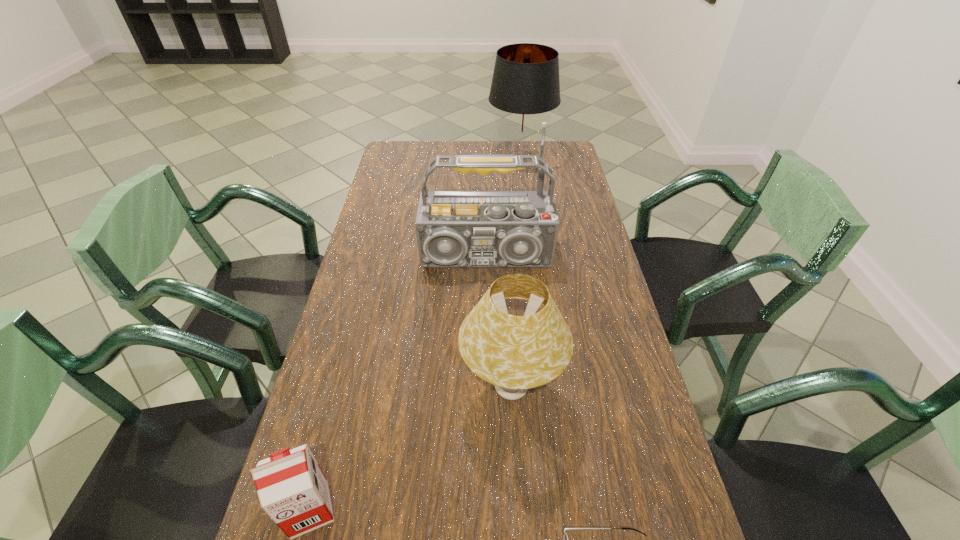
The image size is (960, 540). Identify the location of the farther lampshade. (525, 86).

The image size is (960, 540). In order to click on the farthest object in this screenshot , I will do `click(525, 86)`.

Where is `radio receiver`? radio receiver is located at coordinates (455, 229).

Where is `the third tallest object`? The width and height of the screenshot is (960, 540). the third tallest object is located at coordinates (514, 353).

The image size is (960, 540). I want to click on the shorter lampshade, so click(x=514, y=353).

Image resolution: width=960 pixels, height=540 pixels. Find the location of `the fourth tallest object`. the fourth tallest object is located at coordinates (292, 489).

Image resolution: width=960 pixels, height=540 pixels. I want to click on soya milk, so click(292, 489).

The image size is (960, 540). In order to click on free location located 0.060m on the right of the farther lampshade in this screenshot , I will do pyautogui.click(x=568, y=157).

At what (x,y) coordinates should I click in order to perform the action: click on vacant region located on the front-facing side of the radio receiver. Please return your answer as a coordinate pair (x, y). Looking at the image, I should click on (488, 342).

Locate an element on the screen. Image resolution: width=960 pixels, height=540 pixels. vacant space located 0.230m on the left of the shorter lampshade is located at coordinates (363, 388).